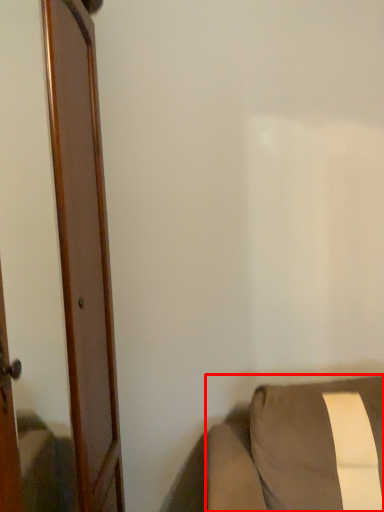
Question: Observing the image, what is the correct spatial positioning of furniture (annotated by the red box) in reference to door?

Choices:
 (A) left
 (B) right

Answer: (B)